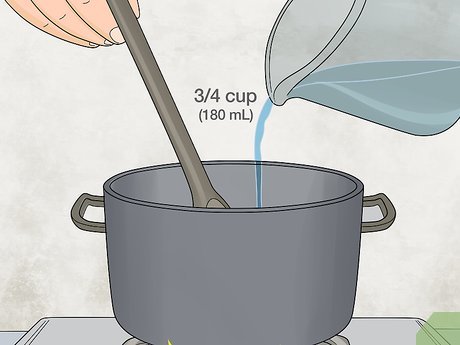
At what (x,y) coordinates should I click in order to perform the action: click on pot handle. Please return your answer as a coordinate pair (x, y). Looking at the image, I should click on (389, 218).